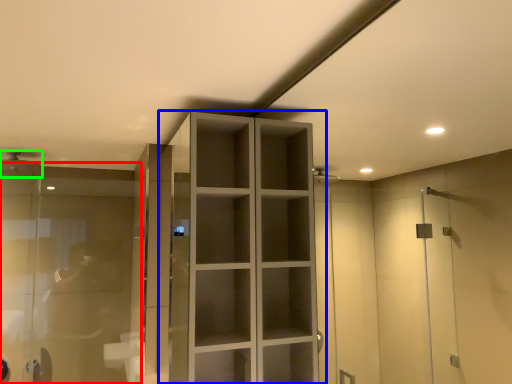
Question: Which object is positioned farthest from glass door (highlighted by a red box)? Select from cupboard (highlighted by a blue box) and shower (highlighted by a green box).

Choices:
 (A) cupboard
 (B) shower

Answer: (A)